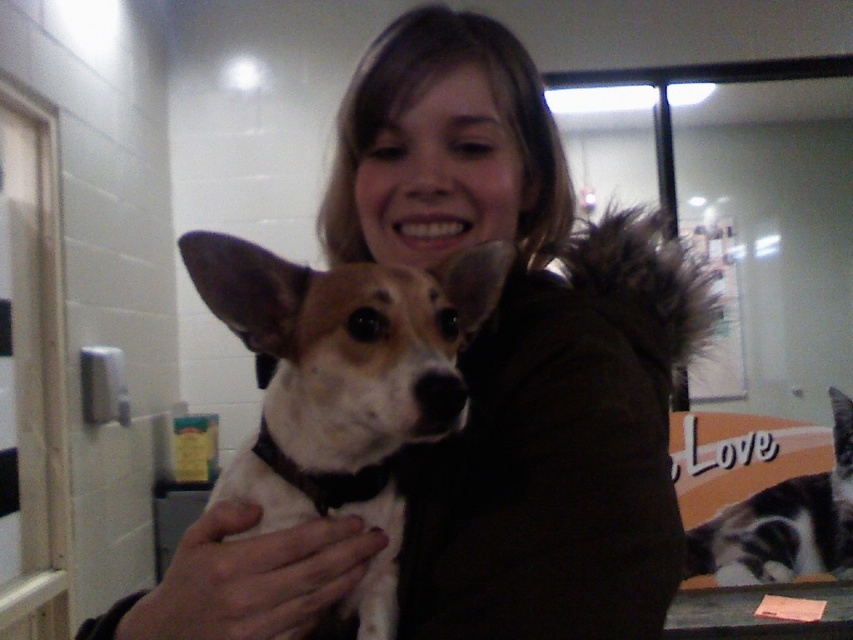
Question: Does white fur dog at center have a larger size compared to gray and white fur cat at lower right?

Choices:
 (A) yes
 (B) no

Answer: (B)

Question: Which point appears closest to the camera in this image?

Choices:
 (A) (697, 532)
 (B) (254, 308)

Answer: (B)

Question: Where is white fur dog at center located in relation to gray and white fur cat at lower right in the image?

Choices:
 (A) above
 (B) below

Answer: (A)

Question: Can you confirm if white fur dog at center is thinner than gray and white fur cat at lower right?

Choices:
 (A) yes
 (B) no

Answer: (A)

Question: Which point is closer to the camera?

Choices:
 (A) (339, 614)
 (B) (833, 417)

Answer: (A)